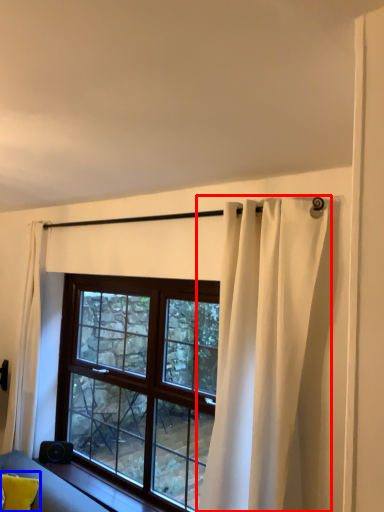
Question: Which of the following is the closest to the observer, curtain (highlighted by a red box) or pillow (highlighted by a blue box)?

Choices:
 (A) curtain
 (B) pillow

Answer: (A)